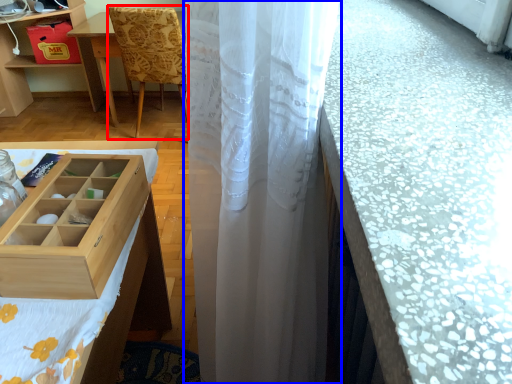
Question: Which object appears closest to the camera in this image, chair (highlighted by a red box) or curtain (highlighted by a blue box)?

Choices:
 (A) chair
 (B) curtain

Answer: (B)